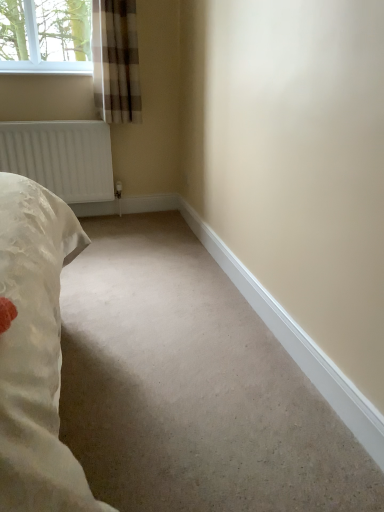
Question: Considering the relative sizes of plaid fabric curtain at upper left and white matte radiator at left in the image provided, is plaid fabric curtain at upper left shorter than white matte radiator at left?

Choices:
 (A) yes
 (B) no

Answer: (B)

Question: Is plaid fabric curtain at upper left wider than white matte radiator at left?

Choices:
 (A) no
 (B) yes

Answer: (B)

Question: From a real-world perspective, is plaid fabric curtain at upper left on white matte radiator at left?

Choices:
 (A) yes
 (B) no

Answer: (A)

Question: Can you confirm if plaid fabric curtain at upper left is taller than white matte radiator at left?

Choices:
 (A) no
 (B) yes

Answer: (B)

Question: Is plaid fabric curtain at upper left thinner than white matte radiator at left?

Choices:
 (A) no
 (B) yes

Answer: (A)

Question: Is plaid fabric curtain at upper left positioned behind white matte radiator at left?

Choices:
 (A) no
 (B) yes

Answer: (A)

Question: Is white matte radiator at left thinner than plaid fabric curtain at upper left?

Choices:
 (A) yes
 (B) no

Answer: (A)

Question: Is white matte radiator at left positioned beyond the bounds of plaid fabric curtain at upper left?

Choices:
 (A) yes
 (B) no

Answer: (A)

Question: Is white matte radiator at left touching plaid fabric curtain at upper left?

Choices:
 (A) no
 (B) yes

Answer: (A)

Question: Is white matte radiator at left aimed at plaid fabric curtain at upper left?

Choices:
 (A) yes
 (B) no

Answer: (B)

Question: Does white matte radiator at left have a greater width compared to plaid fabric curtain at upper left?

Choices:
 (A) yes
 (B) no

Answer: (B)

Question: Considering the relative sizes of white matte radiator at left and plaid fabric curtain at upper left in the image provided, is white matte radiator at left shorter than plaid fabric curtain at upper left?

Choices:
 (A) yes
 (B) no

Answer: (A)

Question: Is point (117, 77) positioned closer to the camera than point (46, 172)?

Choices:
 (A) closer
 (B) farther

Answer: (A)